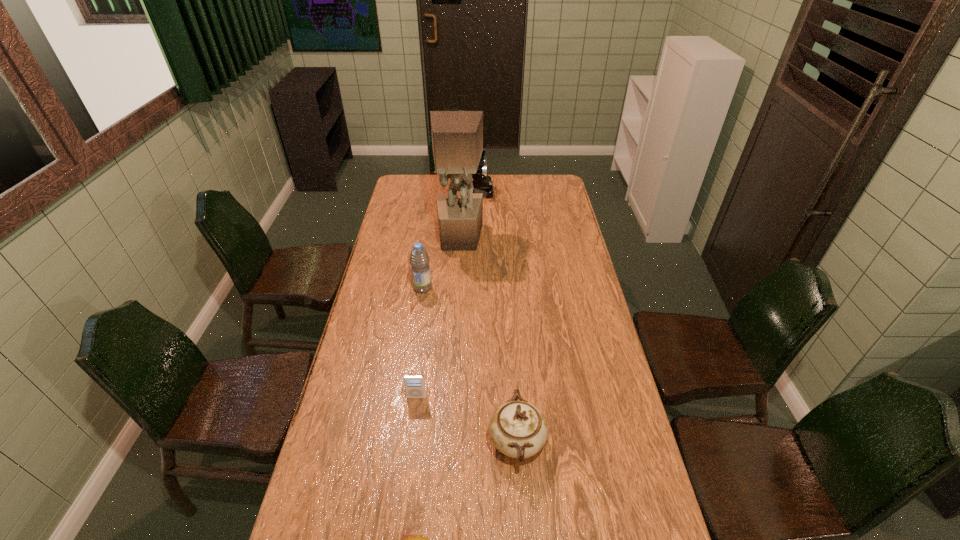
I want to click on vacant point located 0.190m on the lens mount of the camcorder, so click(530, 192).

Where is `free region located on the back of the water bottle`? free region located on the back of the water bottle is located at coordinates (428, 248).

I want to click on vacant space located 0.190m on the right of the second nearest object, so click(612, 442).

I want to click on free location located on the front-facing side of the iPod, so click(405, 489).

Identify the location of object located at the far edge. (482, 183).

Locate an element on the screen. Image resolution: width=960 pixels, height=540 pixels. free space at the far edge of the desktop is located at coordinates (520, 192).

The height and width of the screenshot is (540, 960). In the image, there is a desktop. What are the coordinates of `free space at the left edge` in the screenshot? It's located at (361, 315).

Image resolution: width=960 pixels, height=540 pixels. I want to click on vacant space at the right edge of the desktop, so click(554, 213).

In the image, there is a desktop. What are the coordinates of `free space at the far right corner` in the screenshot? It's located at (557, 189).

You are a GUI agent. You are given a task and a screenshot of the screen. Output one action in this format:
    pyautogui.click(x=<x>, y=<y>)
    Task: Click on the vacant point located between the tallest object and the third farthest object
    Image resolution: width=960 pixels, height=540 pixels.
    Given the screenshot: What is the action you would take?
    pyautogui.click(x=441, y=262)